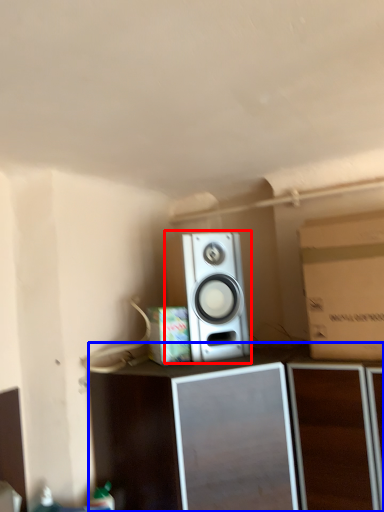
Question: Among these objects, which one is nearest to the camera, home appliance (highlighted by a red box) or furniture (highlighted by a blue box)?

Choices:
 (A) home appliance
 (B) furniture

Answer: (B)